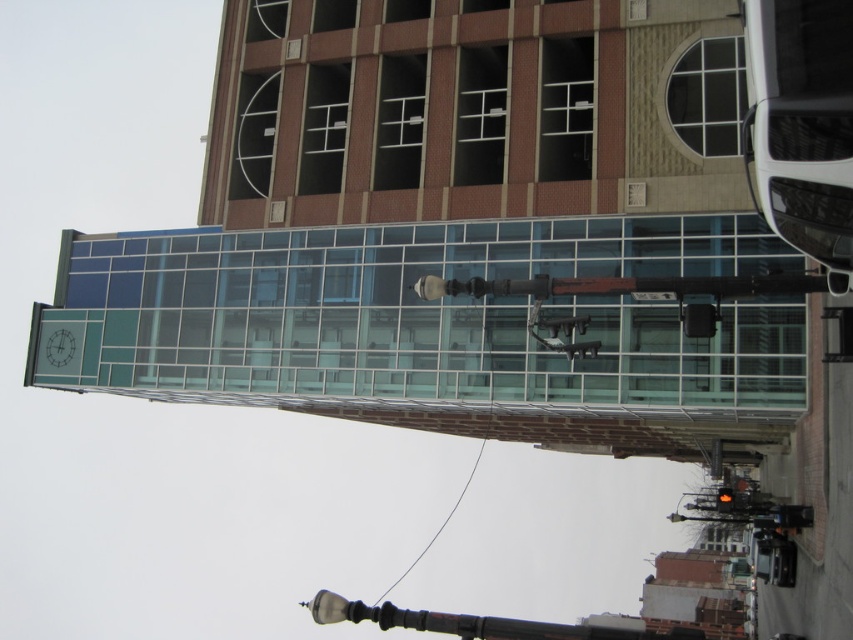
Which is more to the left, clear wire at center or orange glass traffic light at center?

clear wire at center

Looking at this image, can you confirm if clear wire at center is bigger than orange glass traffic light at center?

Yes, clear wire at center is bigger than orange glass traffic light at center.

Describe the element at coordinates (439, 524) in the screenshot. This screenshot has height=640, width=853. I see `clear wire at center` at that location.

The height and width of the screenshot is (640, 853). I want to click on clear wire at center, so click(x=439, y=524).